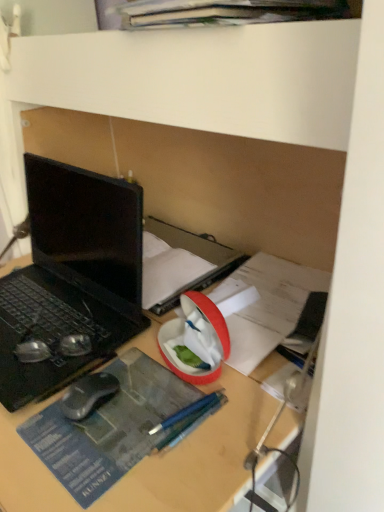
The height and width of the screenshot is (512, 384). Identify the location of free spot to the right of black rubberized mouse at lower left. (144, 395).